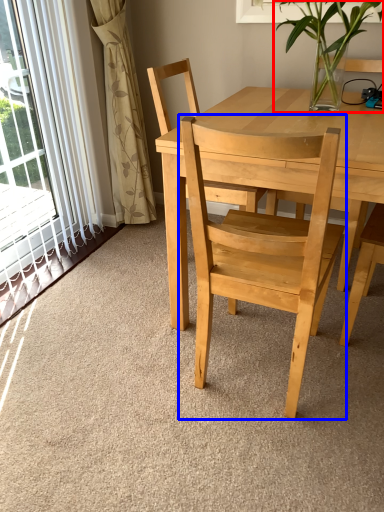
Question: Which point is further to the camera, houseplant (highlighted by a red box) or chair (highlighted by a blue box)?

Choices:
 (A) houseplant
 (B) chair

Answer: (A)